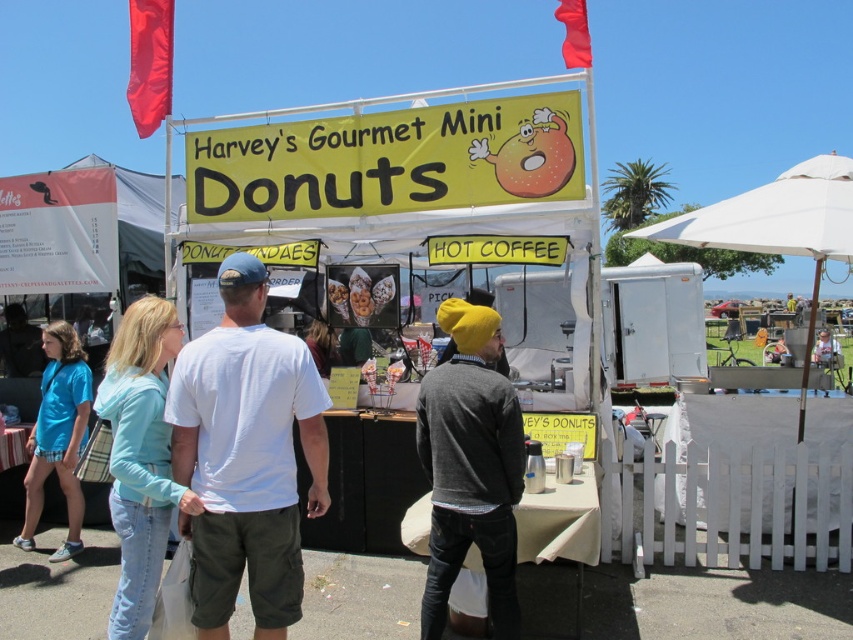
Question: Can you confirm if white cotton t-shirt at center is positioned below white fabric canopy at upper right?

Choices:
 (A) yes
 (B) no

Answer: (A)

Question: Considering the relative positions of white fabric canopy at upper right and blue cotton shirt at left in the image provided, where is white fabric canopy at upper right located with respect to blue cotton shirt at left?

Choices:
 (A) above
 (B) below

Answer: (A)

Question: Which of these objects is positioned farthest from the knit yellow beanie at center?

Choices:
 (A) white cotton t-shirt at center
 (B) white fabric canopy at upper right

Answer: (B)

Question: Does white fabric canopy at upper right have a greater width compared to blue cotton shirt at left?

Choices:
 (A) yes
 (B) no

Answer: (A)

Question: Which of the following is the farthest from the observer?

Choices:
 (A) knit yellow beanie at center
 (B) white cotton t-shirt at center
 (C) blue cotton shirt at left
 (D) white metallic food truck at center

Answer: (D)

Question: Which object is positioned closest to the knit yellow beanie at center?

Choices:
 (A) blue cotton shirt at left
 (B) white cotton t-shirt at center
 (C) white fabric canopy at upper right
 (D) white metallic food truck at center

Answer: (B)